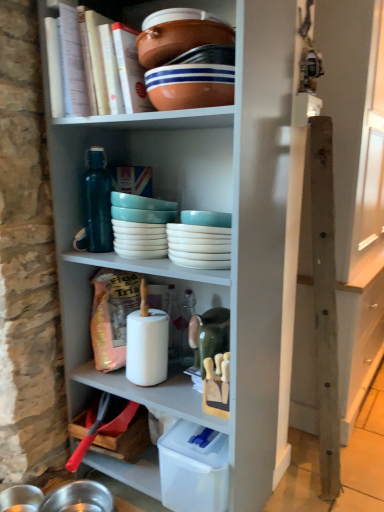
Question: From the image's perspective, is hardcover book at upper center over matte ceramic bowl at upper center, which appears as the first bowl when ordered from the bottom?

Choices:
 (A) no
 (B) yes

Answer: (B)

Question: From a real-world perspective, is hardcover book at upper center on top of matte ceramic bowl at upper center, positioned as the second bowl in top-to-bottom order?

Choices:
 (A) yes
 (B) no

Answer: (A)

Question: Can you confirm if hardcover book at upper center is thinner than matte ceramic bowl at upper center, which appears as the first bowl when ordered from the bottom?

Choices:
 (A) yes
 (B) no

Answer: (B)

Question: Does hardcover book at upper center come in front of matte ceramic bowl at upper center, which appears as the first bowl when ordered from the bottom?

Choices:
 (A) no
 (B) yes

Answer: (A)

Question: Can you confirm if hardcover book at upper center is positioned to the right of matte ceramic bowl at upper center, which appears as the first bowl when ordered from the bottom?

Choices:
 (A) no
 (B) yes

Answer: (A)

Question: Is hardcover book at upper center touching matte ceramic bowl at upper center, which appears as the first bowl when ordered from the bottom?

Choices:
 (A) yes
 (B) no

Answer: (B)

Question: Is white glossy bowls at center, the 2th tableware viewed from the left, surrounding brown ceramic bowl at upper center, the 2th bowl when ordered from bottom to top?

Choices:
 (A) no
 (B) yes

Answer: (A)

Question: Is brown ceramic bowl at upper center, the 1th bowl when ordered from top to bottom, at the back of white glossy bowls at center, the 2th tableware viewed from the left?

Choices:
 (A) yes
 (B) no

Answer: (B)

Question: Does white glossy bowls at center, the 2th tableware viewed from the left, have a greater height compared to brown ceramic bowl at upper center, the 2th bowl when ordered from bottom to top?

Choices:
 (A) no
 (B) yes

Answer: (B)

Question: From a real-world perspective, is white glossy bowls at center, the 2th tableware viewed from the left, located beneath brown ceramic bowl at upper center, the 2th bowl when ordered from bottom to top?

Choices:
 (A) no
 (B) yes

Answer: (B)

Question: From the image's perspective, would you say white glossy bowls at center, the 1th tableware viewed from the right, is positioned over brown ceramic bowl at upper center, the 1th bowl when ordered from top to bottom?

Choices:
 (A) yes
 (B) no

Answer: (B)

Question: From the image's perspective, is white glossy bowls at center, the 2th tableware viewed from the left, below brown ceramic bowl at upper center, the 2th bowl when ordered from bottom to top?

Choices:
 (A) no
 (B) yes

Answer: (B)

Question: Does hardcover book at upper center have a greater height compared to wooden post at right?

Choices:
 (A) no
 (B) yes

Answer: (A)